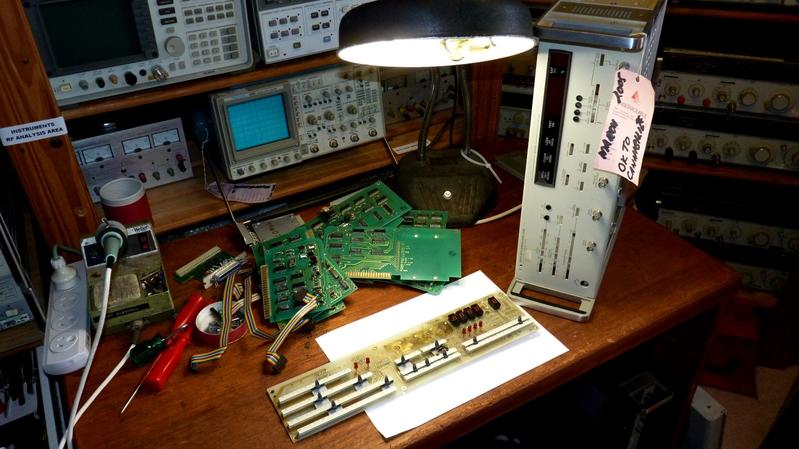
Identify the location of light bulb. (474, 41).